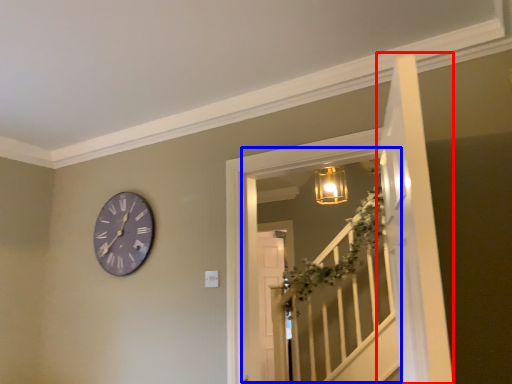
Question: Which point is further to the camera, door (highlighted by a red box) or window (highlighted by a blue box)?

Choices:
 (A) door
 (B) window

Answer: (B)